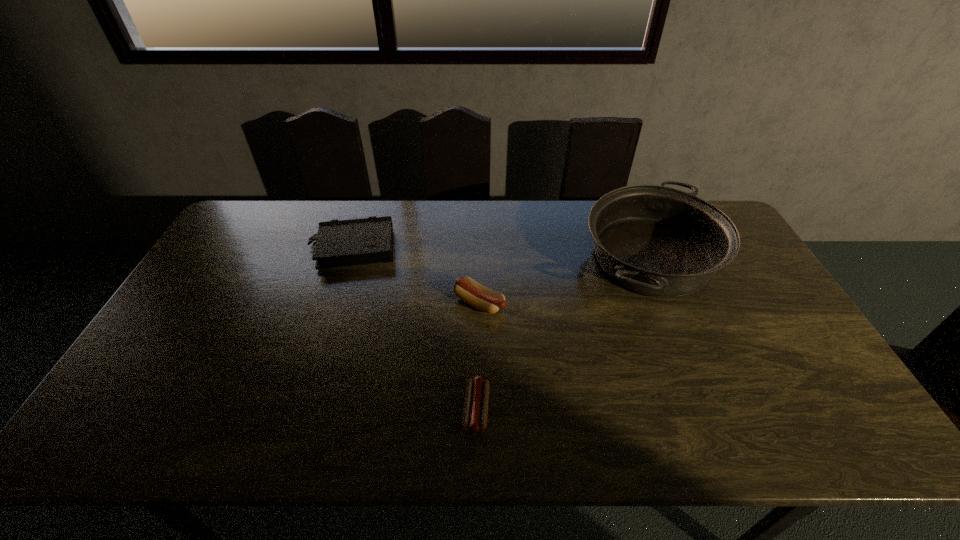
Locate which object is the third closest to the farther sausage. Please provide its 2D coordinates. Your answer should be formatted as a tuple, i.e. [(x, y)], where the tuple contains the x and y coordinates of a point satisfying the conditions above.

[(658, 241)]

Where is `vacant region that satisfies the following two spatial constraints: 1. on the front side of the leftmost object; 2. on the left side of the nearest object`? The height and width of the screenshot is (540, 960). vacant region that satisfies the following two spatial constraints: 1. on the front side of the leftmost object; 2. on the left side of the nearest object is located at coordinates (300, 410).